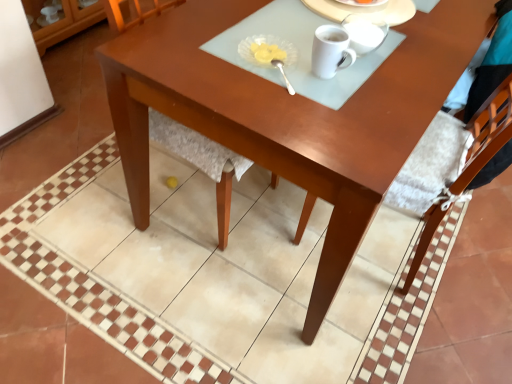
The height and width of the screenshot is (384, 512). What are the coordinates of `free location in front of white glossy mug at upper center, which is the 4th tableware in bottom-to-top order` in the screenshot? It's located at (351, 8).